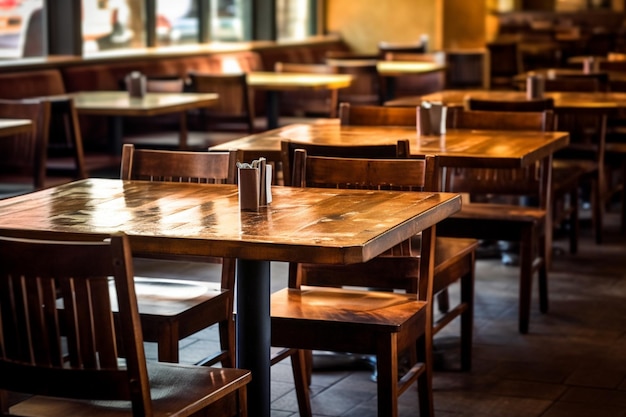
Identify the location of table organizer. The width and height of the screenshot is (626, 417). 255,190, 433,117, 536,85, 136,86.